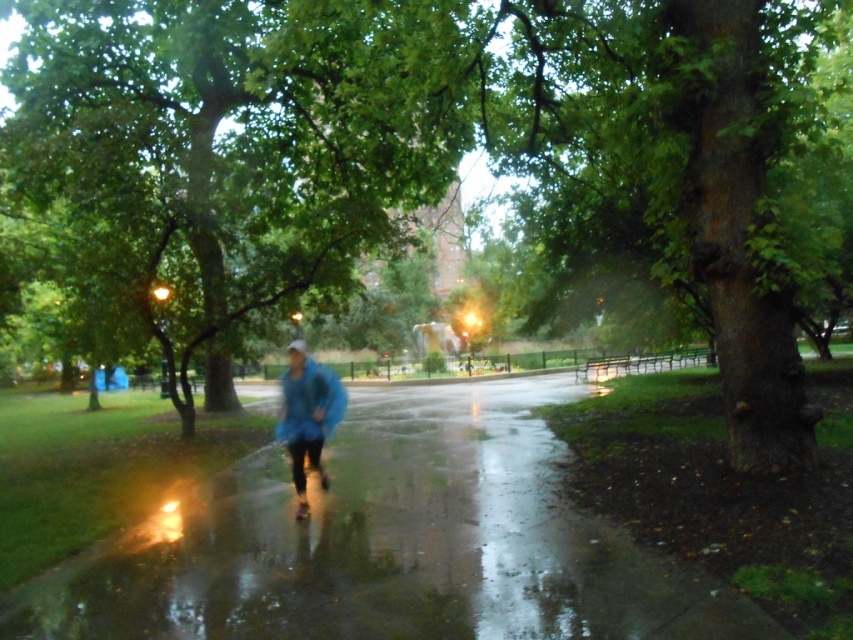
You are a drone operator trying to capture a clear aerial shot of the glossy asphalt pavement at center in the park scene. The drone has a camera with a 120mm focal length lens. Considering the scene described, what is the approximate distance in meters the drone should maintain to ensure the pavement fills the frame without distortion?

The glossy asphalt pavement at center is located at coordinates point (x=389, y=544). To calculate the required distance, use the formula distance equals focal length multiplied by sensor size divided by subject size. However, without knowing the sensor size or the actual dimensions of the pavement, an exact distance cannot be determined. The drone should be positioned at a distance that allows the camera to focus on the pavement while avoiding distortion caused by proximity to the wet, reflective surface.